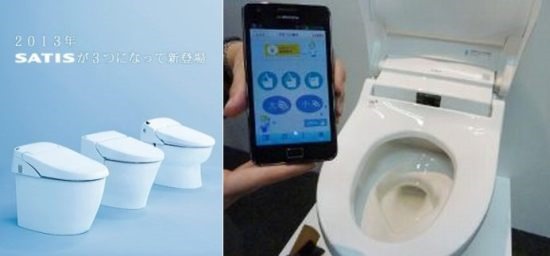
In order to click on black floor in this screenshot , I will do `click(272, 234)`.